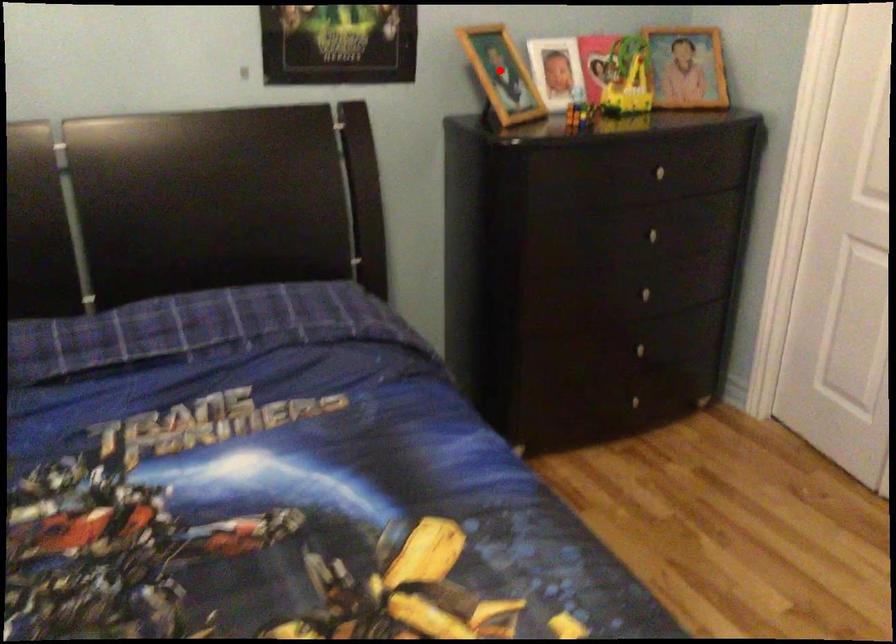
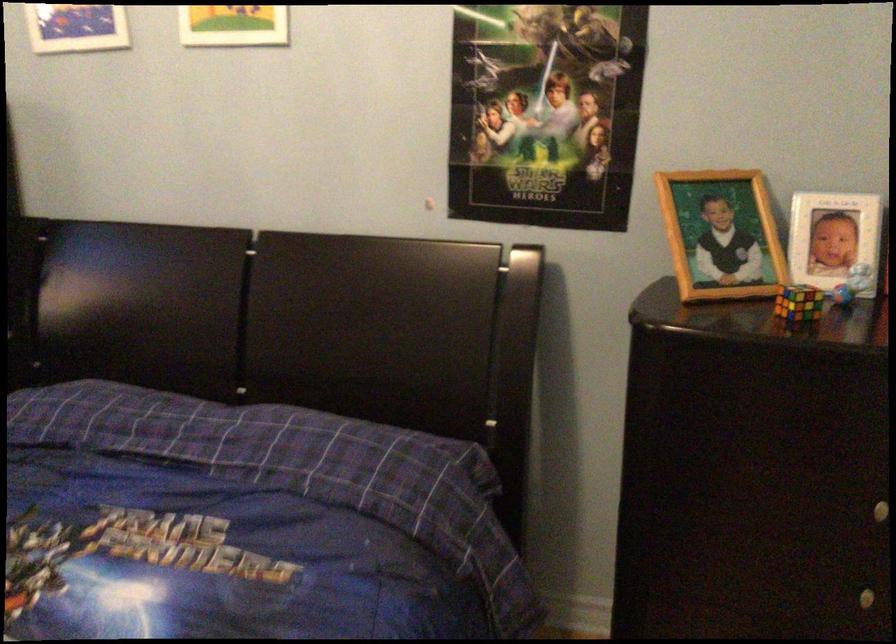
Where in the second image is the point corresponding to the highlighted location from the first image?

(720, 234)